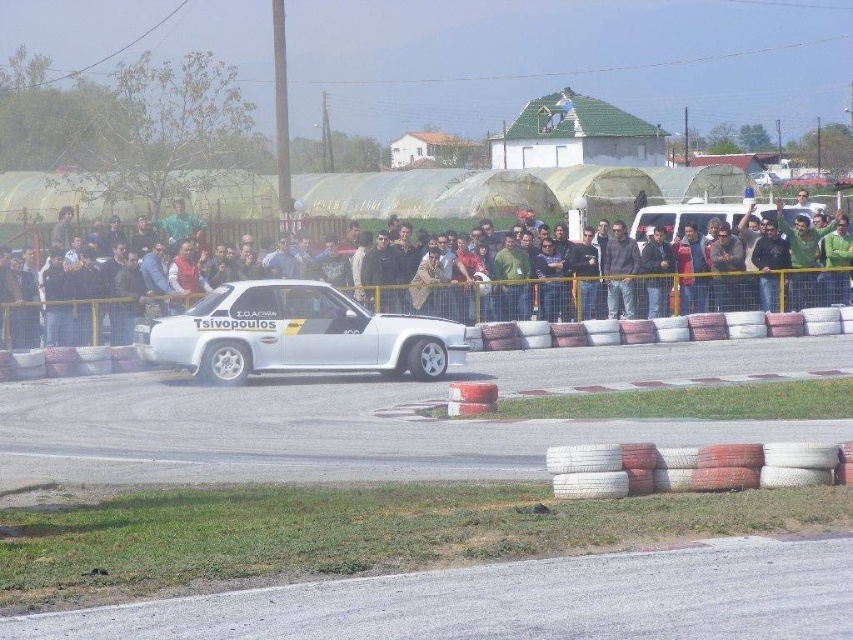
You are standing at the motorsport event and want to know how far the point marked at coordinates (236, 310) is from you. Can you determine the distance?

The point marked at coordinates (236, 310) is 22.90 meters away from the viewer.

Based on the photo, you are a photographer at the motorsport event and want to capture a photo where both the white glossy car at center and the silver metallic tire at center are visible. Since the car is taller, will you need to adjust your camera angle to ensure both are fully in frame?

The white glossy car at center is taller than the silver metallic tire at center, so you should position your camera at a lower angle to capture the full height of the car while still including the tire in the frame.

You are a photographer positioned at the edge of the track. You want to capture a photo of the white matte car at center and the silver metallic tire at center in the same frame. Based on their positions, which object should you focus on first to ensure both are in focus?

The white matte car at center is located above the silver metallic tire at center. To ensure both are in focus, you should focus on the white matte car at center first since it is closer to the camera.